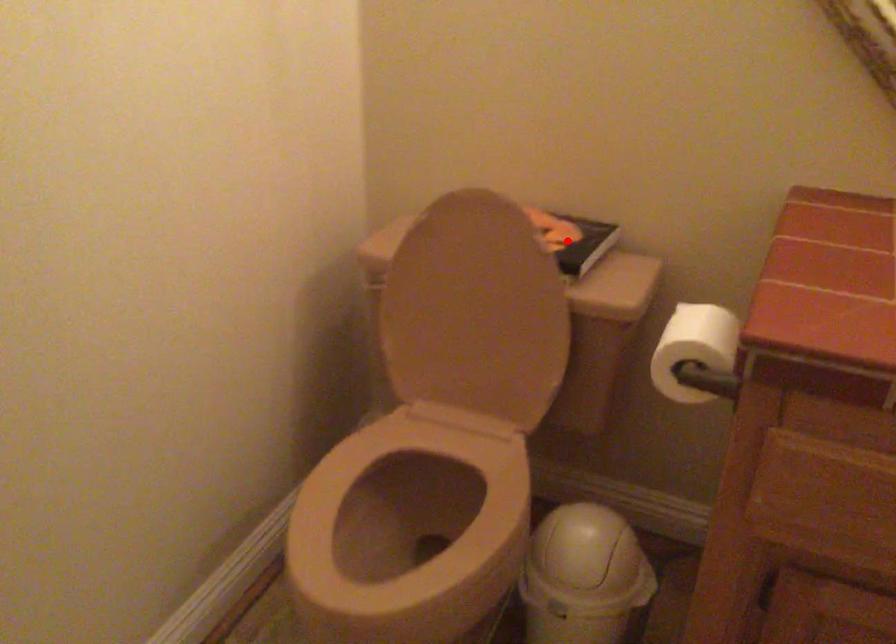
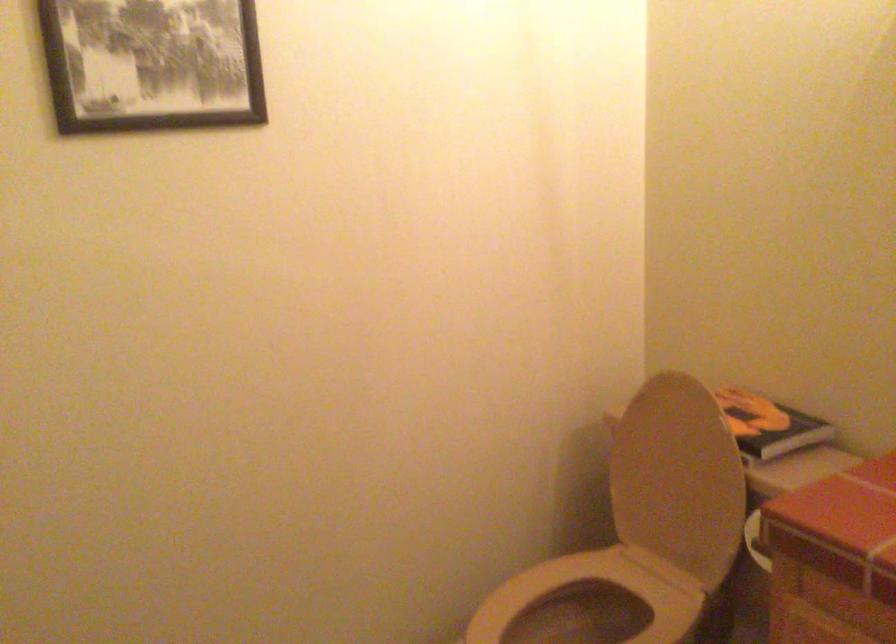
Where in the second image is the point corresponding to the highlighted location from the first image?

(769, 426)